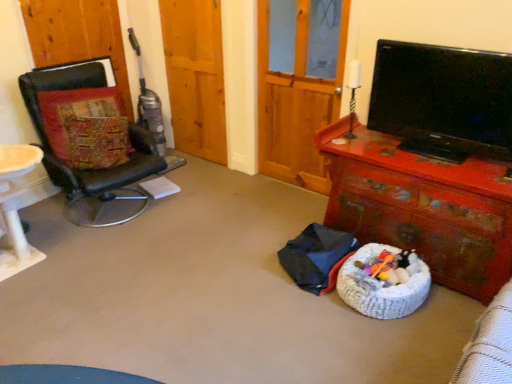
Question: From a real-world perspective, relative to dark blue fabric at center, is textured fabric pillow at left vertically above or below?

Choices:
 (A) below
 (B) above

Answer: (B)

Question: Is textured fabric pillow at left in front of or behind dark blue fabric at center in the image?

Choices:
 (A) front
 (B) behind

Answer: (B)

Question: Estimate the real-world distances between objects in this image. Which object is closer to the wooden screen door at center, the 2th screen door in the left-to-right sequence?

Choices:
 (A) black leather chair at left
 (B) black glossy flat-screen tv at upper right
 (C) textured fabric pillow at left
 (D) dark blue fabric at center
 (E) rusty wooden desk at lower right

Answer: (B)

Question: Estimate the real-world distances between objects in this image. Which object is farther from the dark blue fabric at center?

Choices:
 (A) black glossy flat-screen tv at upper right
 (B) black leather chair at left
 (C) wooden screen door at upper center, acting as the second screen door starting from the right
 (D) textured fabric pillow at left
 (E) rusty wooden desk at lower right

Answer: (C)